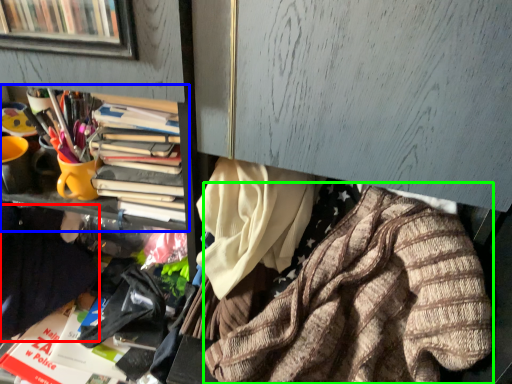
Question: Considering the real-world distances, which object is farthest from clothing (highlighted by a red box)? bookcase (highlighted by a blue box) or clothing (highlighted by a green box)?

Choices:
 (A) bookcase
 (B) clothing

Answer: (B)